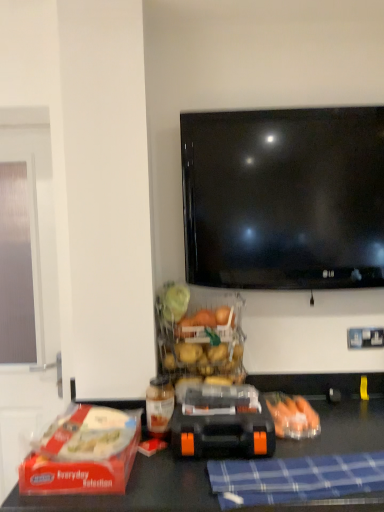
Question: In the image, is translucent plastic bottle at center on the left side or the right side of orange rubber toy car at center?

Choices:
 (A) right
 (B) left

Answer: (B)

Question: In the image, is translucent plastic bottle at center positioned in front of or behind orange rubber toy car at center?

Choices:
 (A) front
 (B) behind

Answer: (B)

Question: Which object is the closest to the translucent plastic bottle at center?

Choices:
 (A) red plastic lunch box at lower left
 (B) translucent plastic carrots at lower right
 (C) orange rubber toy car at center
 (D) blue checkered cloth at lower center

Answer: (C)

Question: Which is nearer to the translucent plastic bottle at center?

Choices:
 (A) blue checkered cloth at lower center
 (B) orange rubber toy car at center
 (C) translucent plastic carrots at lower right
 (D) red plastic lunch box at lower left

Answer: (B)